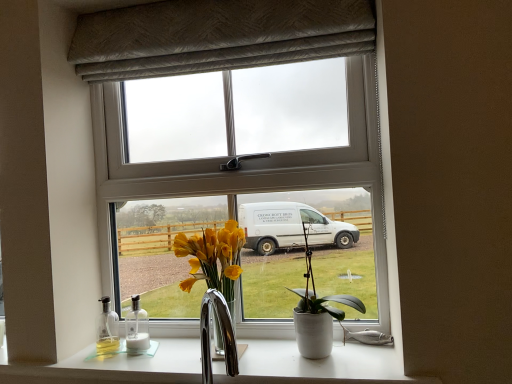
What are the coordinates of `vacant space in front of white glossy bottle at lower left` in the screenshot? It's located at (131, 361).